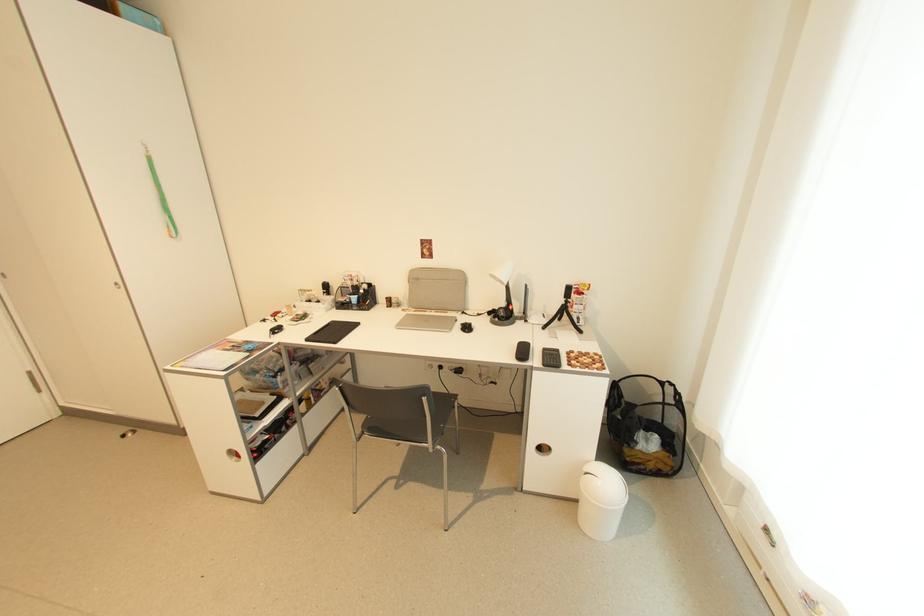
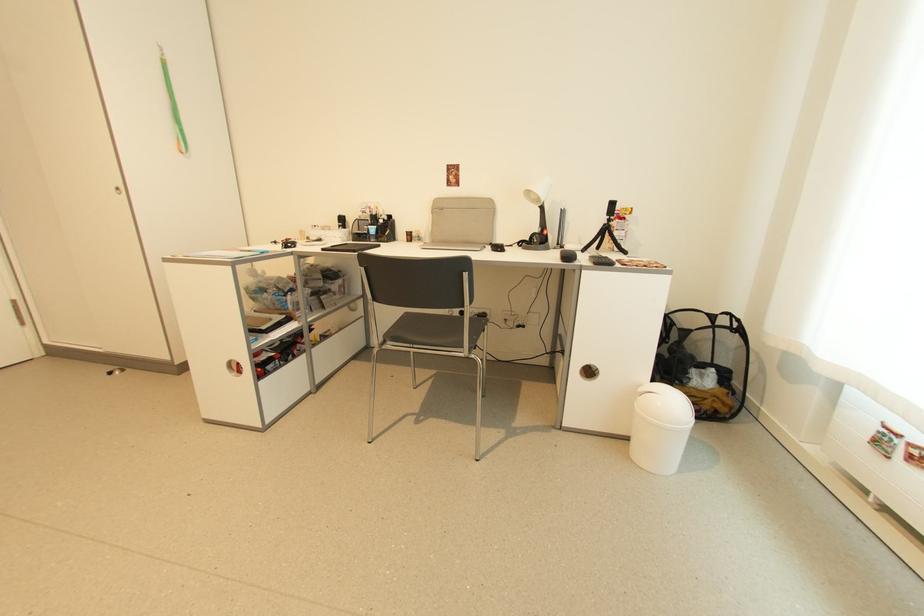
Question: The first image is from the beginning of the video and the second image is from the end. How did the camera likely rotate when shooting the video?

Choices:
 (A) Left
 (B) Right
 (C) Up
 (D) Down

Answer: (C)